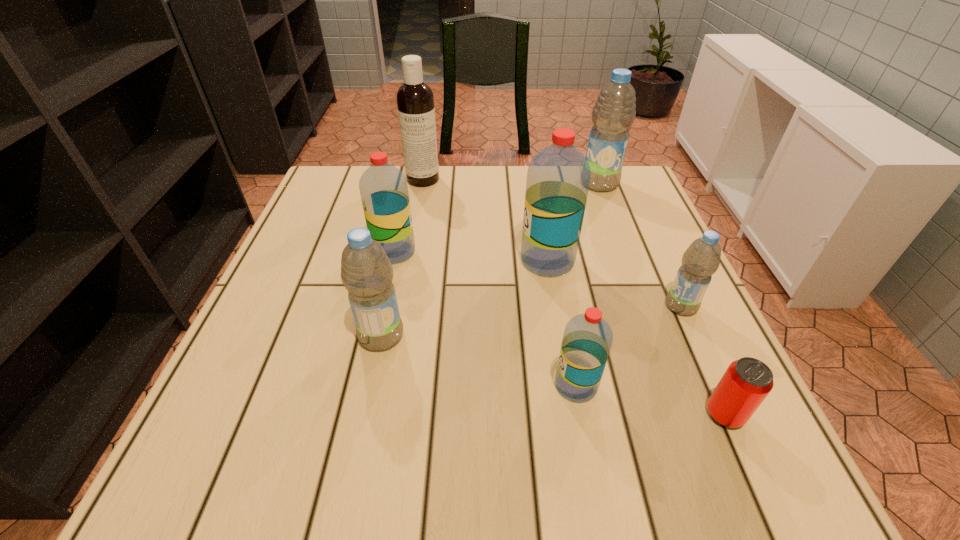
Choose which object is the nearest neighbor to the dishwasher detergent. Please provide its 2D coordinates. Your answer should be formatted as a tuple, i.e. [(x, y)], where the tuple contains the x and y coordinates of a point satisfying the conditions above.

[(383, 188)]

Where is `object that is the sixth closest to the farthest blue water bottle`? object that is the sixth closest to the farthest blue water bottle is located at coordinates (366, 272).

Where is `water bottle that is the fourth closest to the can`? water bottle that is the fourth closest to the can is located at coordinates (366, 272).

Locate an element on the screen. The width and height of the screenshot is (960, 540). water bottle that is the fourth closest to the leftmost red water bottle is located at coordinates (614, 112).

Select which blue water bottle appears as the third closest to the second smallest red water bottle. Please provide its 2D coordinates. Your answer should be formatted as a tuple, i.e. [(x, y)], where the tuple contains the x and y coordinates of a point satisfying the conditions above.

[(700, 261)]

Locate which blue water bottle is the second closest to the nearest water bottle. Please provide its 2D coordinates. Your answer should be formatted as a tuple, i.e. [(x, y)], where the tuple contains the x and y coordinates of a point satisfying the conditions above.

[(366, 272)]

Identify which red water bottle is located as the nearest to the can. Please provide its 2D coordinates. Your answer should be formatted as a tuple, i.e. [(x, y)], where the tuple contains the x and y coordinates of a point satisfying the conditions above.

[(587, 339)]

Where is `red water bottle that can be found as the second closest to the biggest red water bottle`? This screenshot has height=540, width=960. red water bottle that can be found as the second closest to the biggest red water bottle is located at coordinates (383, 188).

Where is `free point that satisfies the following two spatial constraints: 1. on the front label of the second biggest red water bottle; 2. on the right side of the fourth farthest water bottle`? free point that satisfies the following two spatial constraints: 1. on the front label of the second biggest red water bottle; 2. on the right side of the fourth farthest water bottle is located at coordinates (382, 306).

Identify the location of free location that satisfies the following two spatial constraints: 1. on the front label of the biggest red water bottle; 2. on the right side of the shortest object. The width and height of the screenshot is (960, 540). (573, 414).